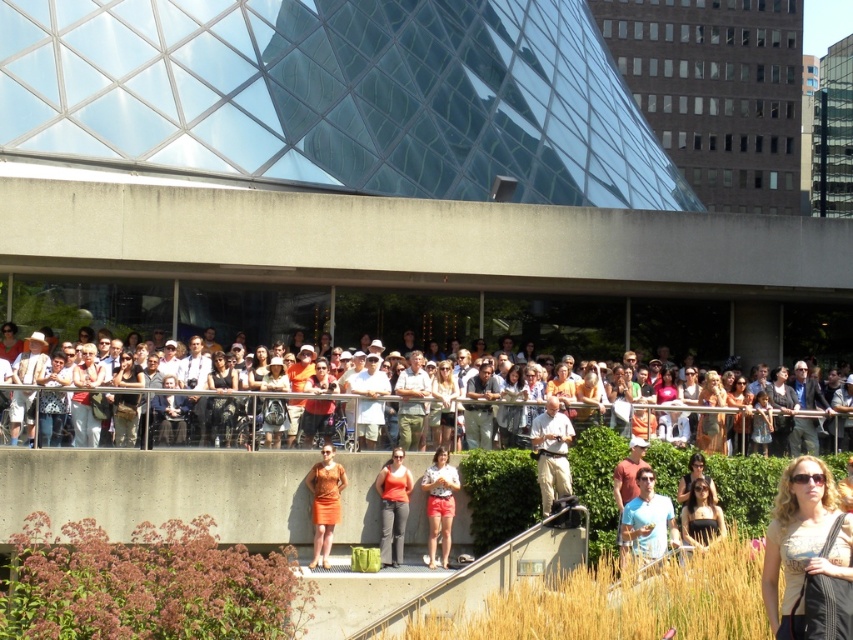
Question: Can you confirm if matte white crowd at center is positioned below orange fabric dress at center?

Choices:
 (A) yes
 (B) no

Answer: (B)

Question: Can you confirm if orange cotton shirt at center is positioned to the left of matte orange dress at lower right?

Choices:
 (A) yes
 (B) no

Answer: (A)

Question: Which point is closer to the camera taking this photo?

Choices:
 (A) (834, 547)
 (B) (428, 532)
 (C) (643, 486)

Answer: (A)

Question: Estimate the real-world distances between objects in this image. Which object is closer to the light brown leather jacket at lower right?

Choices:
 (A) orange fabric dress at center
 (B) khaki pants at center

Answer: (B)

Question: Which point is closer to the camera?

Choices:
 (A) orange fabric dress at center
 (B) light brown leather jacket at lower right
 (C) matte white crowd at center
 (D) matte orange shorts at center

Answer: (B)

Question: Is khaki pants at center below orange fabric dress at center?

Choices:
 (A) yes
 (B) no

Answer: (B)